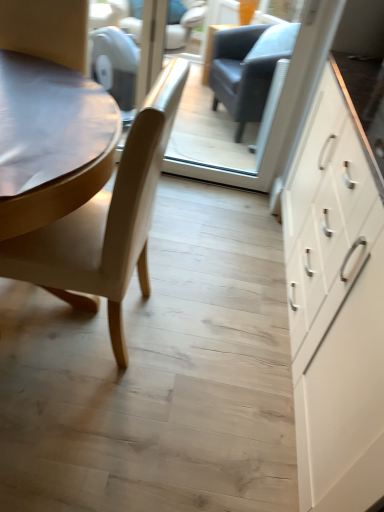
Question: In terms of size, does light beige leather chair at left appear bigger or smaller than white matte cabinet at right?

Choices:
 (A) big
 (B) small

Answer: (B)

Question: From the image's perspective, is light beige leather chair at left located above or below white matte cabinet at right?

Choices:
 (A) above
 (B) below

Answer: (A)

Question: Based on their relative distances, which object is farther from the transparent glass door at center?

Choices:
 (A) white matte cabinet at right
 (B) light beige leather chair at left

Answer: (B)

Question: Which of these objects is positioned closest to the light beige leather chair at left?

Choices:
 (A) white matte cabinet at right
 (B) transparent glass door at center

Answer: (A)